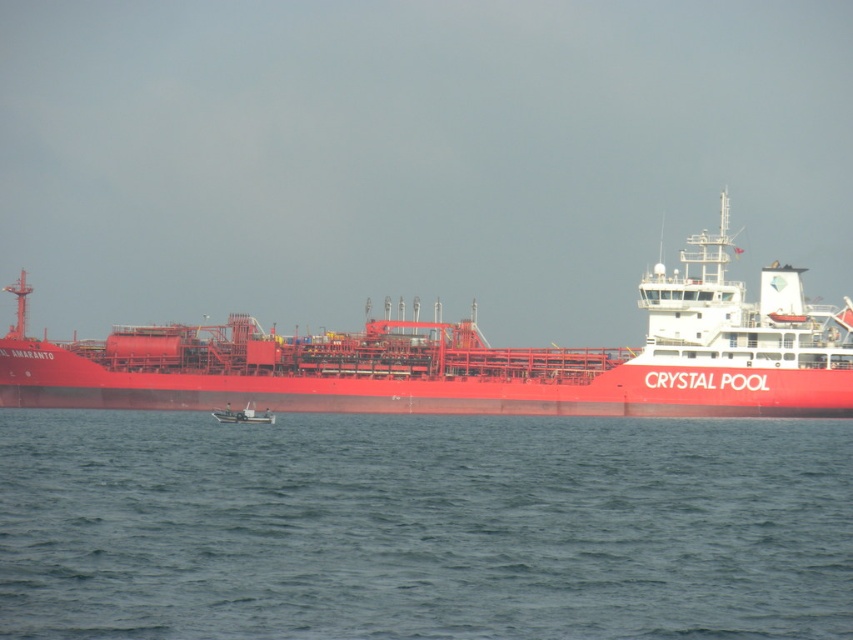
Question: Is metallic red ship at center bigger than metallic gray boat at center?

Choices:
 (A) yes
 (B) no

Answer: (A)

Question: Among these points, which one is farthest from the camera?

Choices:
 (A) (51, 388)
 (B) (219, 413)
 (C) (743, 467)

Answer: (A)

Question: Is blue water at lower center above metallic gray boat at center?

Choices:
 (A) yes
 (B) no

Answer: (B)

Question: Does blue water at lower center appear over metallic red ship at center?

Choices:
 (A) yes
 (B) no

Answer: (B)

Question: Which of the following is the farthest from the observer?

Choices:
 (A) (775, 426)
 (B) (572, 348)

Answer: (B)

Question: Which point is closer to the camera?

Choices:
 (A) metallic red ship at center
 (B) metallic gray boat at center

Answer: (B)